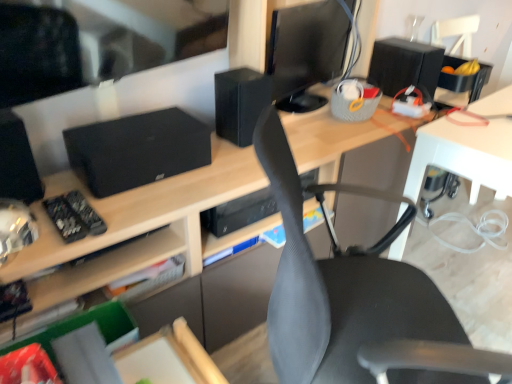
Question: From a real-world perspective, is black matte speaker at left, which appears as the 1th speaker when viewed from the left, over black matte remote control at left?

Choices:
 (A) no
 (B) yes

Answer: (B)

Question: From the image's perspective, is black matte speaker at left, which appears as the 1th speaker when viewed from the left, below black matte remote control at left?

Choices:
 (A) no
 (B) yes

Answer: (A)

Question: Is black matte speaker at left, which appears as the 1th speaker when viewed from the left, aimed at black matte remote control at left?

Choices:
 (A) no
 (B) yes

Answer: (B)

Question: Considering the relative sizes of black matte speaker at left, which appears as the 1th speaker when viewed from the left, and black matte remote control at left in the image provided, is black matte speaker at left, which appears as the 1th speaker when viewed from the left, smaller than black matte remote control at left?

Choices:
 (A) yes
 (B) no

Answer: (B)

Question: Does black matte speaker at left, which appears as the 1th speaker when viewed from the left, have a lesser height compared to black matte remote control at left?

Choices:
 (A) yes
 (B) no

Answer: (B)

Question: Can you confirm if black matte speaker at left, the 3th speaker viewed from the back, is bigger than black matte remote control at left?

Choices:
 (A) no
 (B) yes

Answer: (B)

Question: Is black glossy monitor at upper center closer to the viewer compared to black matte speaker at upper right, the first speaker in the back-to-front sequence?

Choices:
 (A) yes
 (B) no

Answer: (A)

Question: Is black glossy monitor at upper center taller than black matte speaker at upper right, arranged as the third speaker when viewed from the left?

Choices:
 (A) yes
 (B) no

Answer: (A)

Question: Is black glossy monitor at upper center smaller than black matte speaker at upper right, arranged as the third speaker when viewed from the left?

Choices:
 (A) no
 (B) yes

Answer: (A)

Question: From a real-world perspective, is black glossy monitor at upper center under black matte speaker at upper right, acting as the third speaker starting from the front?

Choices:
 (A) no
 (B) yes

Answer: (A)

Question: Considering the relative sizes of black glossy monitor at upper center and black matte speaker at upper right, arranged as the third speaker when viewed from the left, in the image provided, is black glossy monitor at upper center thinner than black matte speaker at upper right, arranged as the third speaker when viewed from the left,?

Choices:
 (A) yes
 (B) no

Answer: (A)

Question: Considering the relative positions of black glossy monitor at upper center and black matte speaker at upper right, placed as the first speaker when sorted from right to left, in the image provided, is black glossy monitor at upper center to the left of black matte speaker at upper right, placed as the first speaker when sorted from right to left, from the viewer's perspective?

Choices:
 (A) no
 (B) yes

Answer: (B)

Question: Is black matte speaker at upper center, which ranks as the second speaker in back-to-front order, aimed at black matte speaker at left, the 3th speaker viewed from the back?

Choices:
 (A) yes
 (B) no

Answer: (B)